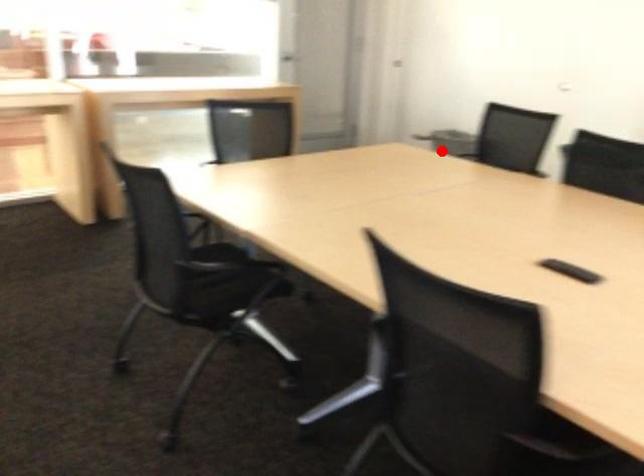
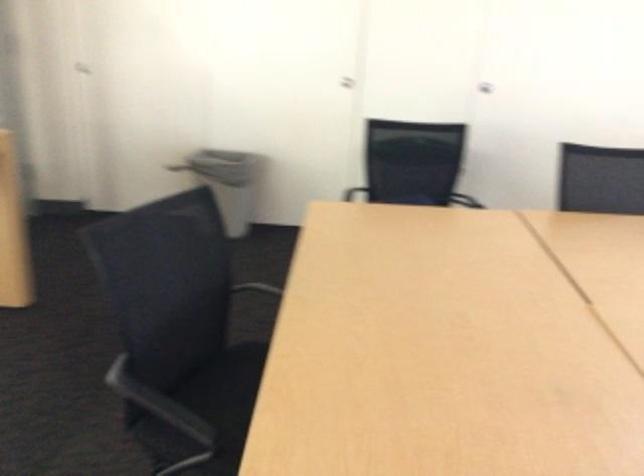
Question: A red point is marked in image1. In image2, is the corresponding 3D point closer to the camera or farther? Reply with the corresponding letter.

Choices:
 (A) The corresponding 3D point is closer.
 (B) The corresponding 3D point is farther.

Answer: (A)